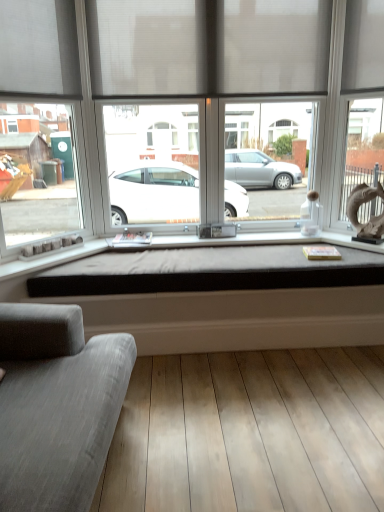
The image size is (384, 512). Describe the element at coordinates (57, 406) in the screenshot. I see `gray fabric couch at lower left` at that location.

The width and height of the screenshot is (384, 512). Identify the location of gray fabric couch at lower left. click(57, 406).

The height and width of the screenshot is (512, 384). In order to click on matte gray window at center in this screenshot , I will do `click(188, 110)`.

At what (x,y) coordinates should I click in order to perform the action: click on matte gray curtain at upper center. Please return your answer as a coordinate pair (x, y). Image resolution: width=384 pixels, height=512 pixels. Looking at the image, I should click on (208, 47).

Considering the relative sizes of matte gray curtain at upper center and gray fabric couch at lower left in the image provided, is matte gray curtain at upper center thinner than gray fabric couch at lower left?

Correct, the width of matte gray curtain at upper center is less than that of gray fabric couch at lower left.

Is matte gray curtain at upper center taller than gray fabric couch at lower left?

In fact, matte gray curtain at upper center may be shorter than gray fabric couch at lower left.

From a real-world perspective, which object rests below the other?

gray fabric couch at lower left, from a real-world perspective.

What's the angular difference between matte gray window at center and light brown wood floor at lower center's facing directions?

89.9 degrees.

Is matte gray window at center next to light brown wood floor at lower center?

No, matte gray window at center is not touching light brown wood floor at lower center.

Could light brown wood floor at lower center be considered to be inside matte gray window at center?

No.

This screenshot has width=384, height=512. Find the location of `window located below the matte gray curtain at upper center (from the image's perspective)`. window located below the matte gray curtain at upper center (from the image's perspective) is located at coordinates (188, 110).

From the picture: Can you confirm if matte gray window at center is bigger than matte gray curtain at upper center?

Yes.

Considering the sizes of matte gray window at center and matte gray curtain at upper center in the image, is matte gray window at center wider or thinner than matte gray curtain at upper center?

Clearly, matte gray window at center has more width compared to matte gray curtain at upper center.

Is point (29, 217) in front of point (93, 36)?

No.

From the image's perspective, is matte gray curtain at upper center positioned above or below light brown wood floor at lower center?

Based on their image positions, matte gray curtain at upper center is located above light brown wood floor at lower center.

From the picture: Can you tell me how much matte gray curtain at upper center and light brown wood floor at lower center differ in facing direction?

The facing directions of matte gray curtain at upper center and light brown wood floor at lower center are 89.9 degrees apart.

Is matte gray curtain at upper center not close to light brown wood floor at lower center?

Yes, matte gray curtain at upper center and light brown wood floor at lower center are located far from each other.

Considering the relative sizes of matte gray curtain at upper center and light brown wood floor at lower center in the image provided, is matte gray curtain at upper center bigger than light brown wood floor at lower center?

Yes.

Is light brown wood floor at lower center to the right of matte gray curtain at upper center from the viewer's perspective?

Yes, light brown wood floor at lower center is to the right of matte gray curtain at upper center.

Are light brown wood floor at lower center and matte gray curtain at upper center far apart?

Yes, light brown wood floor at lower center and matte gray curtain at upper center are located far from each other.

Measure the distance from light brown wood floor at lower center to matte gray curtain at upper center.

light brown wood floor at lower center and matte gray curtain at upper center are 7.49 feet apart.

Between light brown wood floor at lower center and matte gray window at center, which one has less height?

Standing shorter between the two is light brown wood floor at lower center.

Which object is wider, light brown wood floor at lower center or matte gray window at center?

light brown wood floor at lower center is wider.

Which is less distant, (180, 408) or (38, 226)?

Point (180, 408).

Could you tell me if light brown wood floor at lower center is facing matte gray window at center?

No, light brown wood floor at lower center is not aimed at matte gray window at center.

Looking at this image, from the image's perspective, which one is positioned higher, light brown wood floor at lower center or gray fabric couch at lower left?

gray fabric couch at lower left is shown above in the image.

Which is more to the right, light brown wood floor at lower center or gray fabric couch at lower left?

From the viewer's perspective, light brown wood floor at lower center appears more on the right side.

Would you say light brown wood floor at lower center is a long distance from gray fabric couch at lower left?

light brown wood floor at lower center is actually quite close to gray fabric couch at lower left.

Does point (298, 485) lie in front of point (20, 430)?

No, (298, 485) is further to viewer.

There is a gray fabric couch at lower left. Where is `curtain above it (from a real-world perspective)`? curtain above it (from a real-world perspective) is located at coordinates (208, 47).

I want to click on plank below the matte gray window at center (from the image's perspective), so (250, 433).

In the scene shown: From the image, which object appears to be nearer to light brown wood floor at lower center, matte gray curtain at upper center or gray fabric couch at lower left?

Among the two, gray fabric couch at lower left is located nearer to light brown wood floor at lower center.

From the image, which object appears to be farther from light brown wood floor at lower center, gray fabric couch at lower left or matte gray curtain at upper center?

Among the two, matte gray curtain at upper center is located further to light brown wood floor at lower center.

From the image, which object appears to be farther from gray fabric couch at lower left, light brown wood floor at lower center or matte gray window at center?

Among the two, matte gray window at center is located further to gray fabric couch at lower left.

Which object lies nearer to the anchor point matte gray curtain at upper center, matte gray window at center or light brown wood floor at lower center?

The object closer to matte gray curtain at upper center is matte gray window at center.

Estimate the real-world distances between objects in this image. Which object is closer to gray fabric couch at lower left, matte gray curtain at upper center or matte gray window at center?

matte gray window at center lies closer to gray fabric couch at lower left than the other object.

From the image, which object appears to be farther from gray fabric couch at lower left, light brown wood floor at lower center or matte gray curtain at upper center?

matte gray curtain at upper center is positioned further to the anchor gray fabric couch at lower left.

From the image, which object appears to be farther from light brown wood floor at lower center, gray fabric couch at lower left or matte gray window at center?

matte gray window at center lies further to light brown wood floor at lower center than the other object.

Considering their positions, is matte gray curtain at upper center positioned further to matte gray window at center than gray fabric couch at lower left?

The object further to matte gray window at center is gray fabric couch at lower left.

Image resolution: width=384 pixels, height=512 pixels. In order to click on studio couch between matte gray window at center and light brown wood floor at lower center vertically in this screenshot , I will do `click(57, 406)`.

Identify the location of studio couch that lies between matte gray curtain at upper center and light brown wood floor at lower center from top to bottom. (57, 406).

Locate an element on the screen. This screenshot has width=384, height=512. window between matte gray curtain at upper center and light brown wood floor at lower center vertically is located at coordinates (188, 110).

At what (x,y) coordinates should I click in order to perform the action: click on window positioned between gray fabric couch at lower left and matte gray curtain at upper center from near to far. Please return your answer as a coordinate pair (x, y). Looking at the image, I should click on (188, 110).